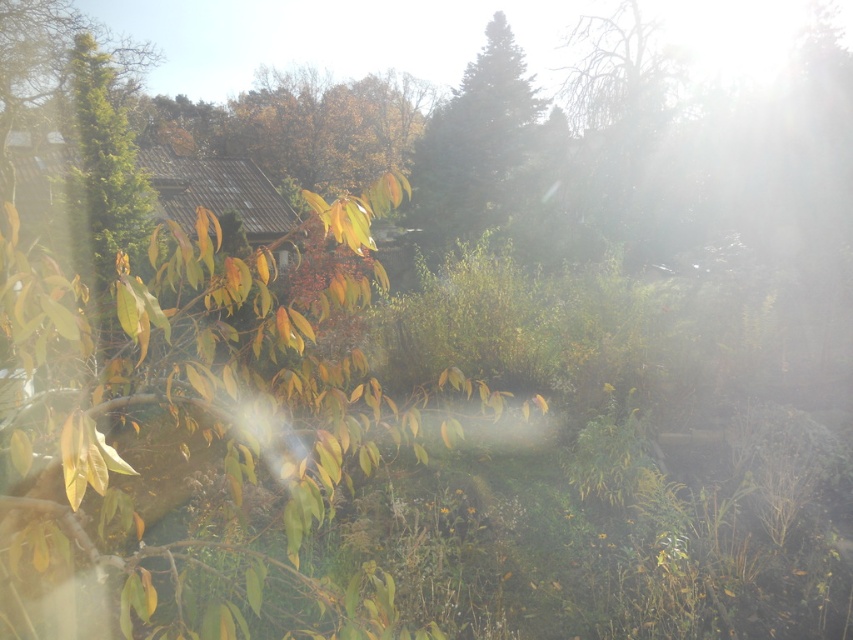
Is green matte tree at center wider than green textured tree at left?

No.

Which is behind, point (469, 115) or point (138, 195)?

Positioned behind is point (469, 115).

Which is in front, point (494, 42) or point (120, 196)?

Point (120, 196) is more forward.

At what (x,y) coordinates should I click in order to perform the action: click on green matte tree at center. Please return your answer as a coordinate pair (x, y). Looking at the image, I should click on pos(474,145).